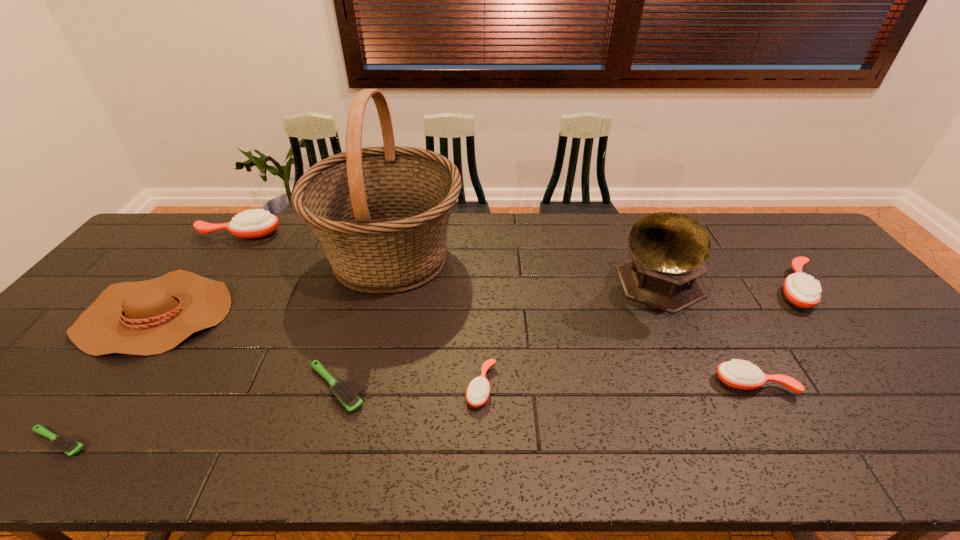
The height and width of the screenshot is (540, 960). Find the location of `object that is at the far left corner`. object that is at the far left corner is located at coordinates (252, 223).

Locate an element on the screen. Image resolution: width=960 pixels, height=540 pixels. object located in the near left corner section of the desktop is located at coordinates (65, 443).

In the image, there is a desktop. Where is `vacant space at the far edge`? This screenshot has width=960, height=540. vacant space at the far edge is located at coordinates (201, 254).

In the image, there is a desktop. What are the coordinates of `vacant space at the near edge` in the screenshot? It's located at (738, 468).

Locate an element on the screen. This screenshot has height=540, width=960. vacant region at the right edge of the desktop is located at coordinates (851, 325).

At what (x,y) coordinates should I click in order to perform the action: click on vacant space at the far left corner of the desktop. Please return your answer as a coordinate pair (x, y). The width and height of the screenshot is (960, 540). Looking at the image, I should click on (170, 237).

What are the coordinates of `free space between the third orange hairbrush from left to right and the second tallest object` in the screenshot? It's located at (704, 335).

The image size is (960, 540). In order to click on free space that is in between the third orange hairbrush from right to left and the fifth nearest hairbrush in this screenshot , I will do `click(639, 338)`.

I want to click on empty space between the rightmost hairbrush and the phonograph record, so click(726, 287).

Locate an element on the screen. free space that is in between the sixth tallest object and the tallest object is located at coordinates (572, 320).